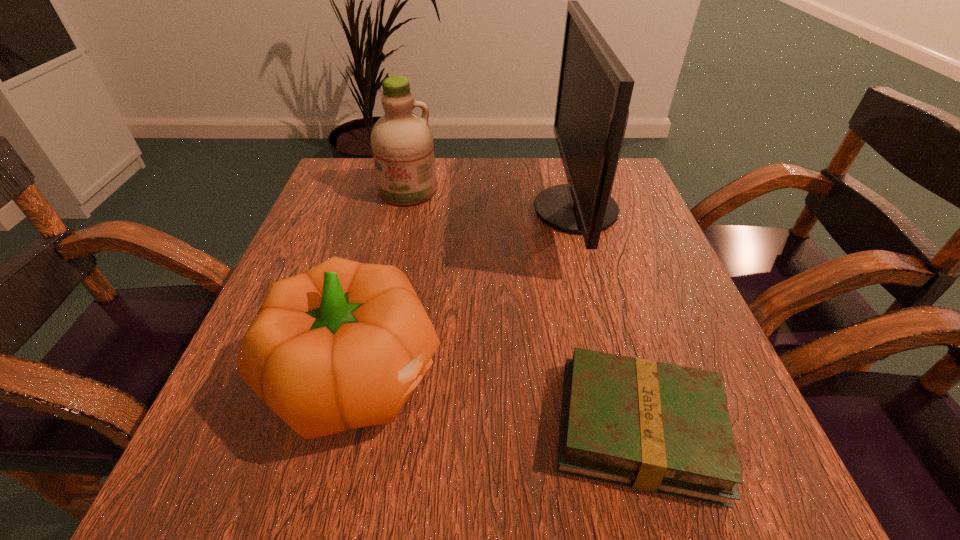
Where is `the tallest object`? the tallest object is located at coordinates (594, 92).

The width and height of the screenshot is (960, 540). I want to click on the third shortest object, so click(402, 145).

You are a GUI agent. You are given a task and a screenshot of the screen. Output one action in this format:
    pyautogui.click(x=<x>, y=<y>)
    Task: Click on the third tallest object
    This screenshot has height=540, width=960.
    Given the screenshot: What is the action you would take?
    pyautogui.click(x=343, y=345)

What are the coordinates of `book` in the screenshot? It's located at (657, 427).

The height and width of the screenshot is (540, 960). Identify the location of vacant space located on the screen side of the monitor. (375, 210).

Locate an element on the screen. vacant space located on the screen side of the monitor is located at coordinates (432, 210).

Image resolution: width=960 pixels, height=540 pixels. I want to click on vacant area situated 0.220m on the screen side of the monitor, so click(x=437, y=210).

Image resolution: width=960 pixels, height=540 pixels. I want to click on vacant region located 0.050m on the front label of the third shortest object, so click(401, 220).

At what (x,y) coordinates should I click in order to perform the action: click on vacant point located 0.200m on the carved face of the third tallest object. Please return your answer as a coordinate pair (x, y). The image size is (960, 540). Looking at the image, I should click on (574, 376).

Locate an element on the screen. This screenshot has height=540, width=960. free space located 0.400m on the back of the shortest object is located at coordinates (579, 217).